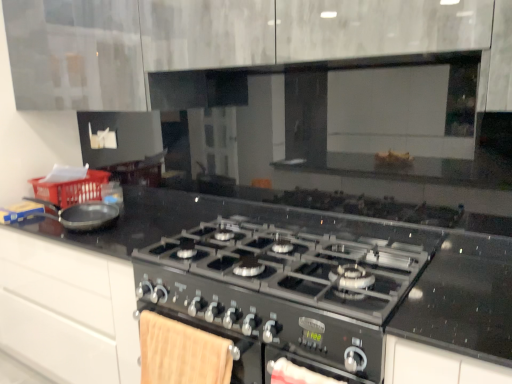
Question: Can you confirm if black metallic gas stove at center is taller than matte black frying pan at left?

Choices:
 (A) no
 (B) yes

Answer: (B)

Question: Is the depth of black metallic gas stove at center greater than that of matte black frying pan at left?

Choices:
 (A) no
 (B) yes

Answer: (A)

Question: Does black metallic gas stove at center have a smaller size compared to matte black frying pan at left?

Choices:
 (A) no
 (B) yes

Answer: (A)

Question: Is black metallic gas stove at center outside of matte black frying pan at left?

Choices:
 (A) yes
 (B) no

Answer: (A)

Question: From a real-world perspective, does black metallic gas stove at center sit lower than matte black frying pan at left?

Choices:
 (A) no
 (B) yes

Answer: (B)

Question: In the image, is black metallic gas stove at center positioned in front of or behind matte black frying pan at left?

Choices:
 (A) behind
 (B) front

Answer: (B)

Question: From their relative heights in the image, would you say black metallic gas stove at center is taller or shorter than matte black frying pan at left?

Choices:
 (A) short
 (B) tall

Answer: (B)

Question: Considering the positions of black metallic gas stove at center and matte black frying pan at left in the image, is black metallic gas stove at center wider or thinner than matte black frying pan at left?

Choices:
 (A) wide
 (B) thin

Answer: (A)

Question: From the image's perspective, is black metallic gas stove at center positioned above or below matte black frying pan at left?

Choices:
 (A) below
 (B) above

Answer: (A)

Question: In terms of size, does matte black frying pan at left appear bigger or smaller than red plastic basket at left?

Choices:
 (A) big
 (B) small

Answer: (B)

Question: From a real-world perspective, is matte black frying pan at left positioned above or below red plastic basket at left?

Choices:
 (A) below
 (B) above

Answer: (B)

Question: Is matte black frying pan at left wider or thinner than red plastic basket at left?

Choices:
 (A) thin
 (B) wide

Answer: (A)

Question: Is matte black frying pan at left to the left or to the right of red plastic basket at left in the image?

Choices:
 (A) left
 (B) right

Answer: (B)

Question: In terms of width, does red plastic basket at left look wider or thinner when compared to black metallic gas stove at center?

Choices:
 (A) wide
 (B) thin

Answer: (B)

Question: Considering their positions, is red plastic basket at left located in front of or behind black metallic gas stove at center?

Choices:
 (A) behind
 (B) front

Answer: (A)